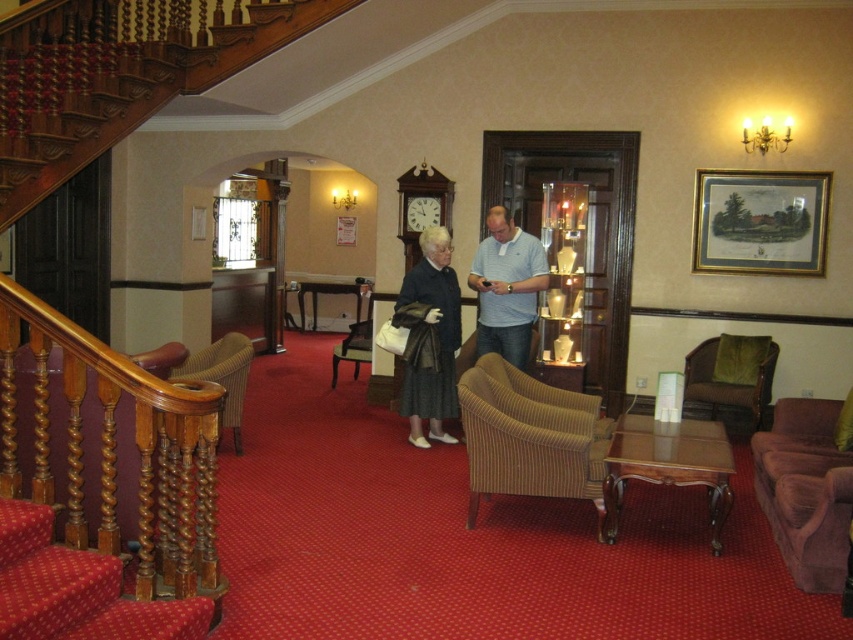
You are standing at the bottom of the staircase and want to move towards the green fabric armchair at right. Which direction should you go to avoid walking behind the brown corduroy armchair at center?

To reach the green fabric armchair at right without going behind the brown corduroy armchair at center, you should move to the right side of the brown corduroy armchair at center since it is in front of the green fabric armchair at right.

You are standing at the bottom of the staircase and want to sit in the green fabric armchair at right. Which direction should you move relative to the velvet purple armchair at lower right?

The velvet purple armchair at lower right is positioned on the left side of the green fabric armchair at right. Therefore, to reach the green fabric armchair at right, you should move to the right side of the velvet purple armchair at lower right.